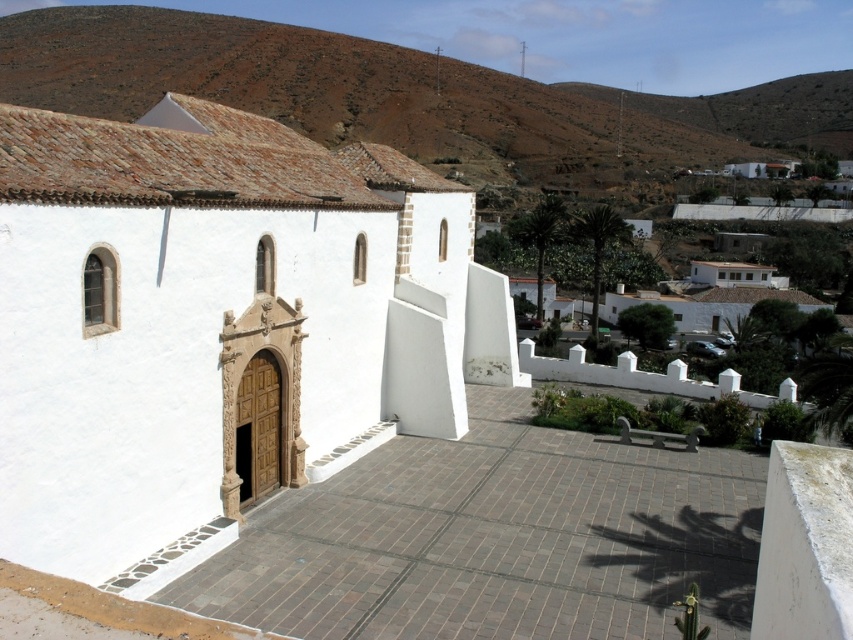
Which is more to the left, white matte church at center or brown clay hillside at upper center?

brown clay hillside at upper center is more to the left.

What do you see at coordinates (216, 326) in the screenshot? The image size is (853, 640). I see `white matte church at center` at bounding box center [216, 326].

The width and height of the screenshot is (853, 640). I want to click on white matte church at center, so click(216, 326).

You are a GUI agent. You are given a task and a screenshot of the screen. Output one action in this format:
    pyautogui.click(x=<x>, y=<y>)
    Task: Click on the white matte church at center
    
    Given the screenshot: What is the action you would take?
    pyautogui.click(x=216, y=326)